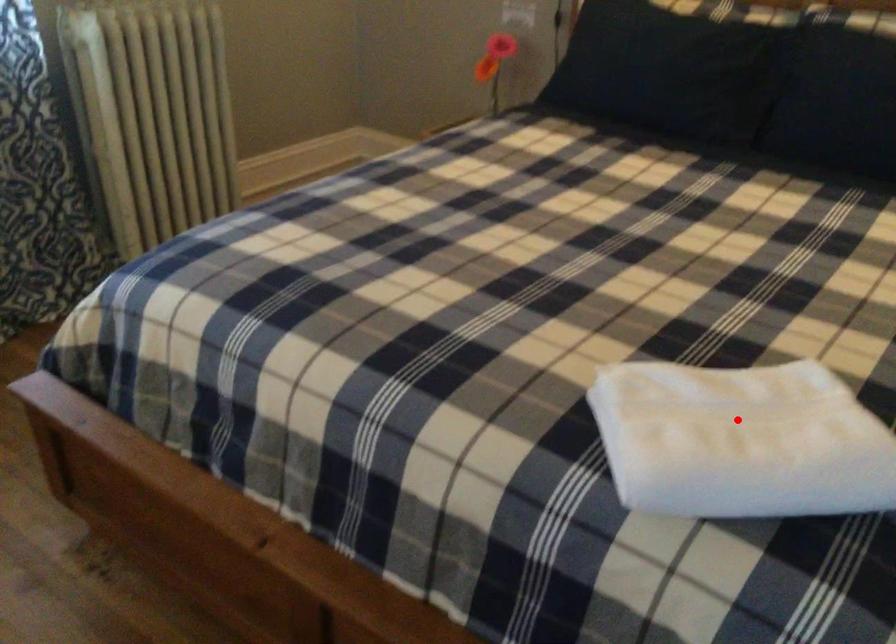
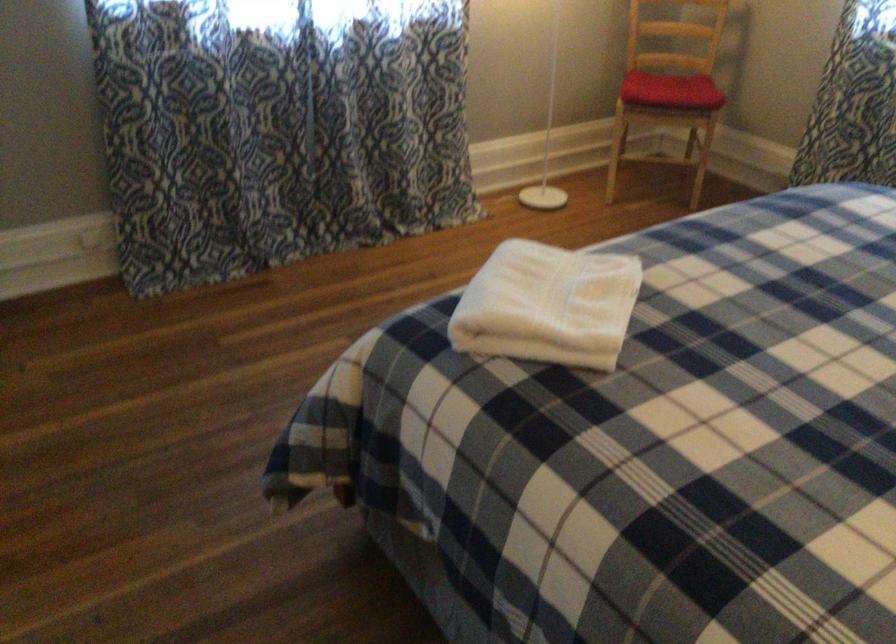
The point at the highlighted location is marked in the first image. Where is the corresponding point in the second image?

(547, 305)